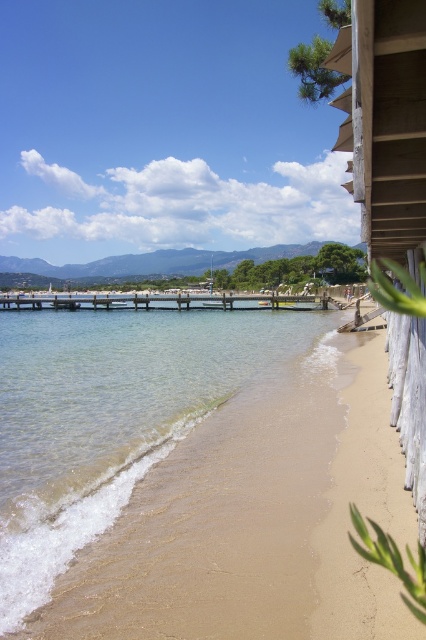
You are standing at the beach and see two points marked on the sand. The first point is at coordinates point (195, 346) and the second is at point (186, 308). Which point is closer to you?

Point (195, 346) is in front of point (186, 308), so it is closer to you.